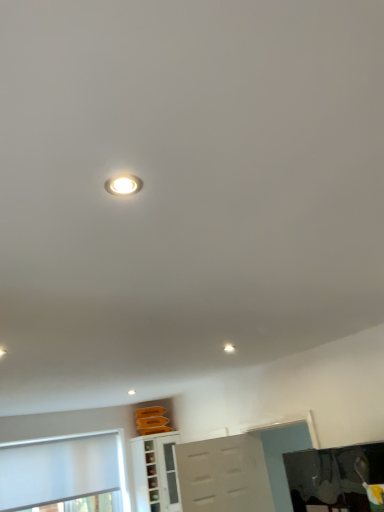
Image resolution: width=384 pixels, height=512 pixels. I want to click on white glossy cabinet at lower center, so click(155, 472).

From a real-world perspective, between white glossy droplight at center and white matte window at lower left, who is vertically lower?

white matte window at lower left.

The width and height of the screenshot is (384, 512). Find the location of `window to the left of white glossy droplight at center`. window to the left of white glossy droplight at center is located at coordinates (62, 470).

In the scene shown: Does white glossy droplight at center have a lesser height compared to white matte window at lower left?

Indeed, white glossy droplight at center has a lesser height compared to white matte window at lower left.

Where is `droplight above the white matte window at lower left (from the image's perspective)`? This screenshot has height=512, width=384. droplight above the white matte window at lower left (from the image's perspective) is located at coordinates (229, 348).

Can you tell me how much white matte window at lower left and white glossy droplight at center differ in facing direction?

The angle between the facing direction of white matte window at lower left and the facing direction of white glossy droplight at center is 90 degrees.

Is the depth of white matte window at lower left greater than that of white glossy droplight at center?

That is True.

Looking at this image, from a real-world perspective, is white matte window at lower left below white glossy droplight at center?

Yes.

Between white matte window at lower left and white glossy cabinet at lower center, which one has larger width?

With larger width is white glossy cabinet at lower center.

Is white matte window at lower left located outside white glossy cabinet at lower center?

Indeed, white matte window at lower left is completely outside white glossy cabinet at lower center.

Who is shorter, white matte window at lower left or white glossy cabinet at lower center?

white matte window at lower left is shorter.

Considering the sizes of white glossy cabinet at lower center and white matte window at lower left in the image, is white glossy cabinet at lower center wider or thinner than white matte window at lower left?

Clearly, white glossy cabinet at lower center has more width compared to white matte window at lower left.

What's the angular difference between white glossy cabinet at lower center and white matte window at lower left's facing directions?

The angular difference between white glossy cabinet at lower center and white matte window at lower left is 0.00197 degrees.

Could you tell me if white glossy cabinet at lower center is turned towards white matte window at lower left?

No, white glossy cabinet at lower center is not oriented towards white matte window at lower left.

Considering the positions of objects white glossy cabinet at lower center and white matte window at lower left in the image provided, who is in front, white glossy cabinet at lower center or white matte window at lower left?

white matte window at lower left is closer to the camera.

Based on their sizes in the image, would you say white glossy droplight at center is bigger or smaller than white glossy cabinet at lower center?

In the image, white glossy droplight at center appears to be smaller than white glossy cabinet at lower center.

Is white glossy droplight at center looking in the opposite direction of white glossy cabinet at lower center?

No, white glossy cabinet at lower center is not at the back of white glossy droplight at center.

Between white glossy droplight at center and white glossy cabinet at lower center, which one appears on the right side from the viewer's perspective?

white glossy droplight at center.

Considering the positions of points (229, 352) and (159, 459), is point (229, 352) farther from camera compared to point (159, 459)?

No, (229, 352) is in front of (159, 459).

Is point (170, 453) closer or farther from the camera than point (228, 345)?

Clearly, point (170, 453) is more distant from the camera than point (228, 345).

Between white glossy cabinet at lower center and white glossy droplight at center, which one has smaller size?

With smaller size is white glossy droplight at center.

From the image's perspective, does white glossy cabinet at lower center appear higher than white glossy droplight at center?

Actually, white glossy cabinet at lower center appears below white glossy droplight at center in the image.

Which is correct: white glossy cabinet at lower center is inside white glossy droplight at center, or outside of it?

white glossy cabinet at lower center is spatially situated outside white glossy droplight at center.

The image size is (384, 512). In order to click on window behind the white glossy droplight at center in this screenshot , I will do `click(62, 470)`.

In the image, there is a white matte window at lower left. Where is `droplight above it (from the image's perspective)`? This screenshot has height=512, width=384. droplight above it (from the image's perspective) is located at coordinates (229, 348).

Looking at the image, which one is located closer to white glossy cabinet at lower center, white matte window at lower left or white glossy droplight at center?

white matte window at lower left is closer to white glossy cabinet at lower center.

When comparing their distances from white matte window at lower left, does white glossy droplight at center or white glossy cabinet at lower center seem further?

Based on the image, white glossy droplight at center appears to be further to white matte window at lower left.

From the image, which object appears to be nearer to white glossy droplight at center, white matte window at lower left or white glossy cabinet at lower center?

white glossy cabinet at lower center is closer to white glossy droplight at center.

Estimate the real-world distances between objects in this image. Which object is closer to white glossy cabinet at lower center, white glossy droplight at center or white matte window at lower left?

white matte window at lower left lies closer to white glossy cabinet at lower center than the other object.

Estimate the real-world distances between objects in this image. Which object is further from white glossy droplight at center, white glossy cabinet at lower center or white matte window at lower left?

white matte window at lower left lies further to white glossy droplight at center than the other object.

Considering their positions, is white glossy cabinet at lower center positioned closer to white matte window at lower left than white glossy droplight at center?

white glossy cabinet at lower center.

Locate an element on the screen. Image resolution: width=384 pixels, height=512 pixels. window between white glossy droplight at center and white glossy cabinet at lower center in the up-down direction is located at coordinates (62, 470).